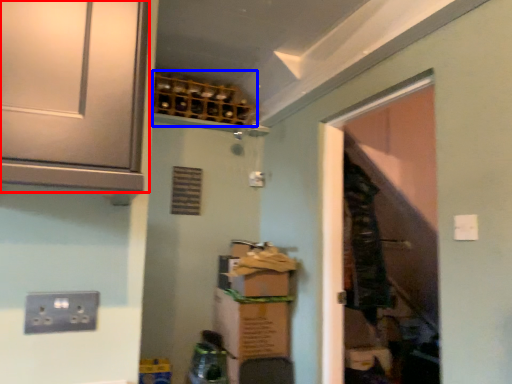
Question: Among these objects, which one is nearest to the camera, cabinetry (highlighted by a red box) or wine rack (highlighted by a blue box)?

Choices:
 (A) cabinetry
 (B) wine rack

Answer: (A)